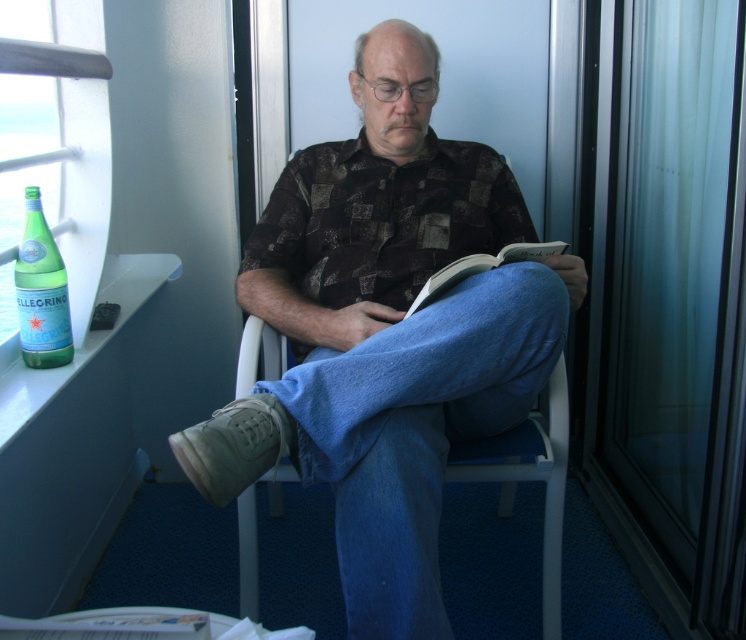
From the picture: Does matte brown shirt at center appear over white paper book at lower left?

Correct, matte brown shirt at center is located above white paper book at lower left.

Between point (554, 262) and point (206, 627), which one is positioned behind?

The point (554, 262) is more distant.

Identify the location of matte brown shirt at center. (386, 332).

Can you confirm if green glass bottle at left is taller than white paper book at lower left?

Yes.

Can you confirm if green glass bottle at left is shorter than white paper book at lower left?

No.

Locate an element on the screen. green glass bottle at left is located at coordinates (40, 291).

Between white paper book at lower left and hardcover book at center, which one has less height?

Standing shorter between the two is white paper book at lower left.

Is white paper book at lower left smaller than hardcover book at center?

Yes.

Between point (19, 628) and point (410, 310), which one is positioned in front?

Point (19, 628)

Locate an element on the screen. The height and width of the screenshot is (640, 746). white paper book at lower left is located at coordinates (110, 625).